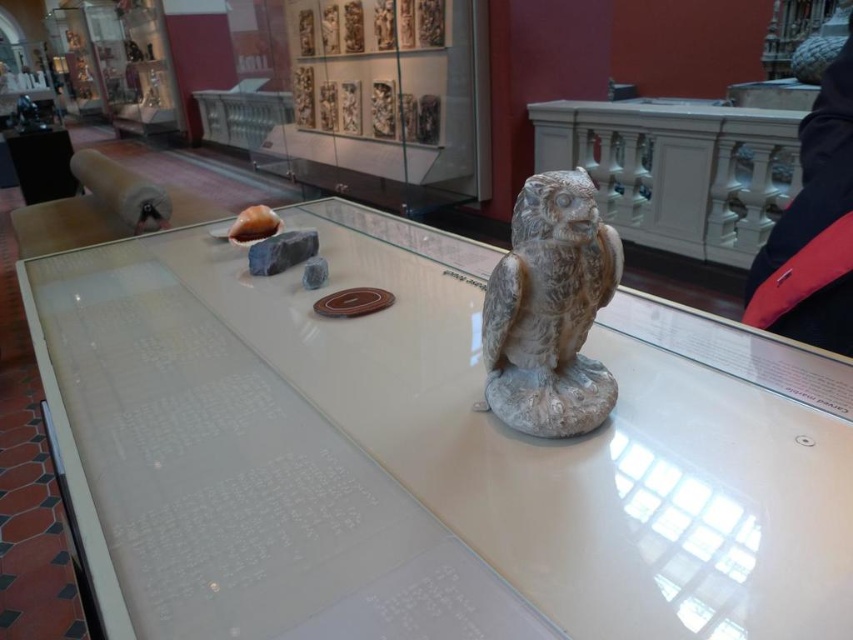
Looking at this image, you are a museum visitor standing in front of the display case. You notice the white glossy table at center and the white stone owl at center. Which object takes up more space in the display case?

The white glossy table at center has a larger size compared to the white stone owl at center, so it takes up more space in the display case.

You are a visitor standing in front of the museum display case. You see the white glossy table at center and the white stone owl at center. Which object is closer to you?

The white glossy table at center is closer to the viewer than the white stone owl at center.

You are standing in front of the museum display case and notice a point marked at coordinates (427, 456). What object in the scene does this point correspond to?

The point at coordinates (427, 456) corresponds to the white glossy table at center.